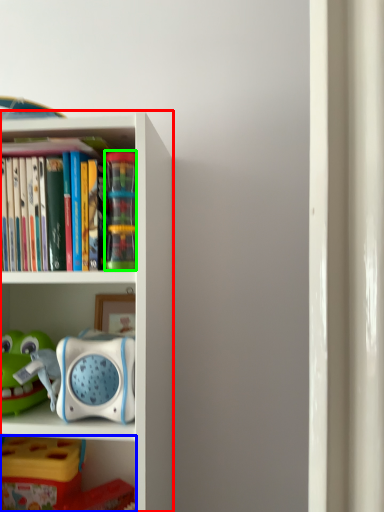
Question: Based on their relative distances, which object is nearer to bookcase (highlighted by a red box)? Choose from shelf (highlighted by a blue box) and toy (highlighted by a green box).

Choices:
 (A) shelf
 (B) toy

Answer: (B)